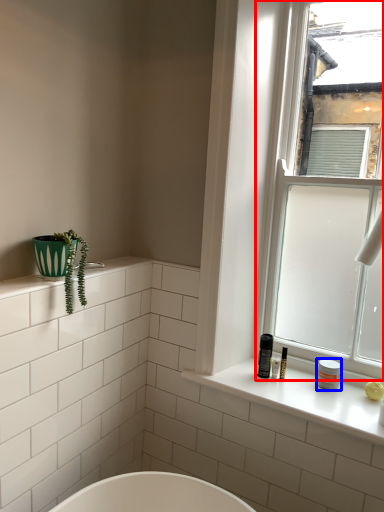
Question: Which point is closer to the camera, window (highlighted by a red box) or toiletry (highlighted by a blue box)?

Choices:
 (A) window
 (B) toiletry

Answer: (A)